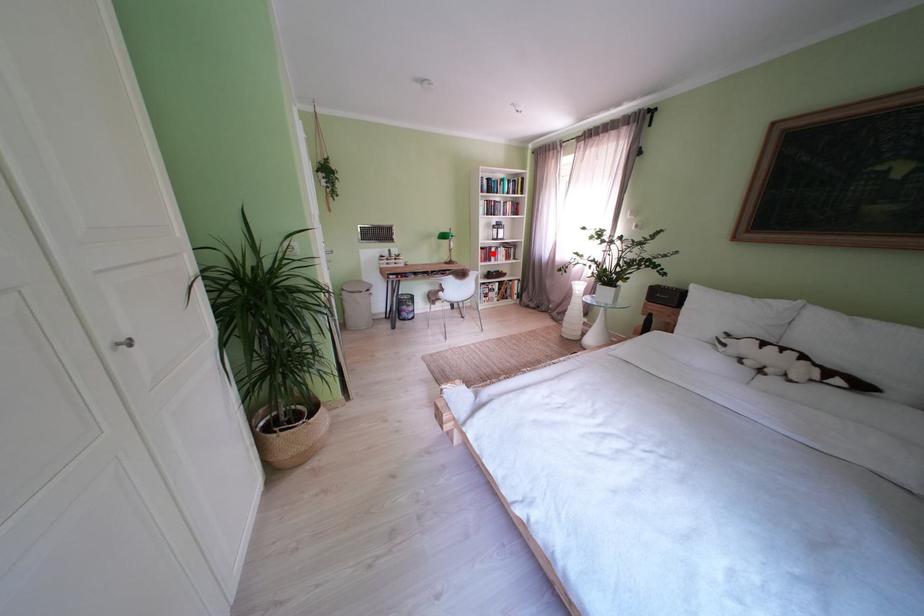
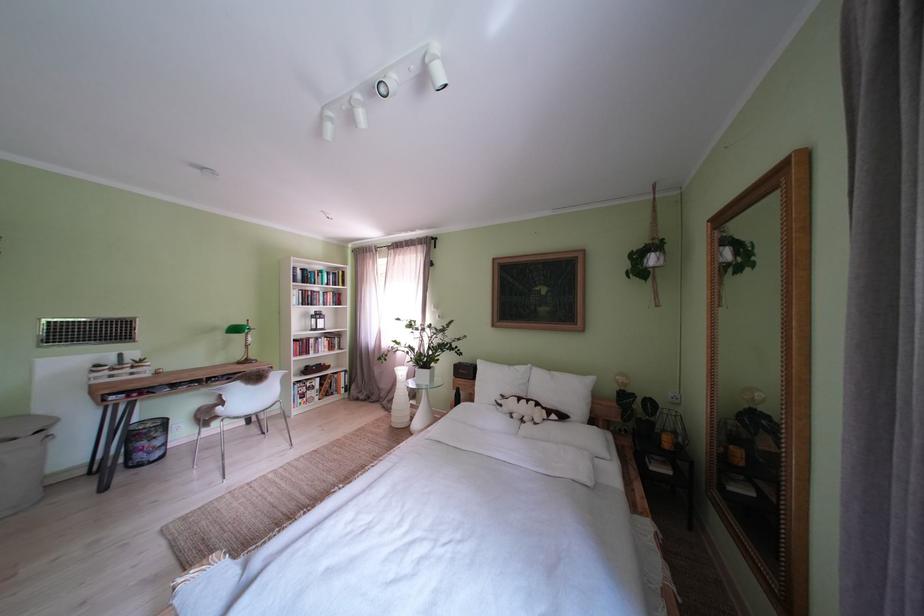
Question: I am providing you with two images of the same scene from different viewpoints. Given a red point in image1, look at the same physical point in image2. Is it:

Choices:
 (A) Closer to the viewpoint
 (B) Farther from the viewpoint

Answer: (B)